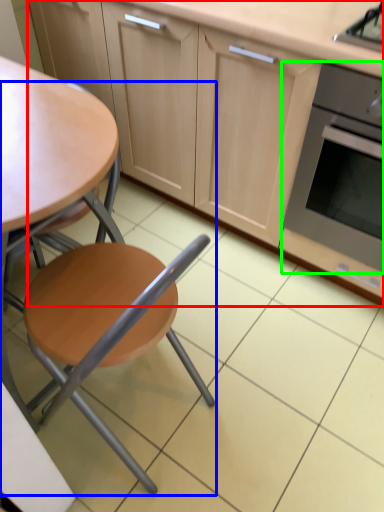
Question: Which object is positioned closest to cabinetry (highlighted by a red box)? Select from chair (highlighted by a blue box) and kitchen appliance (highlighted by a green box).

Choices:
 (A) chair
 (B) kitchen appliance

Answer: (B)